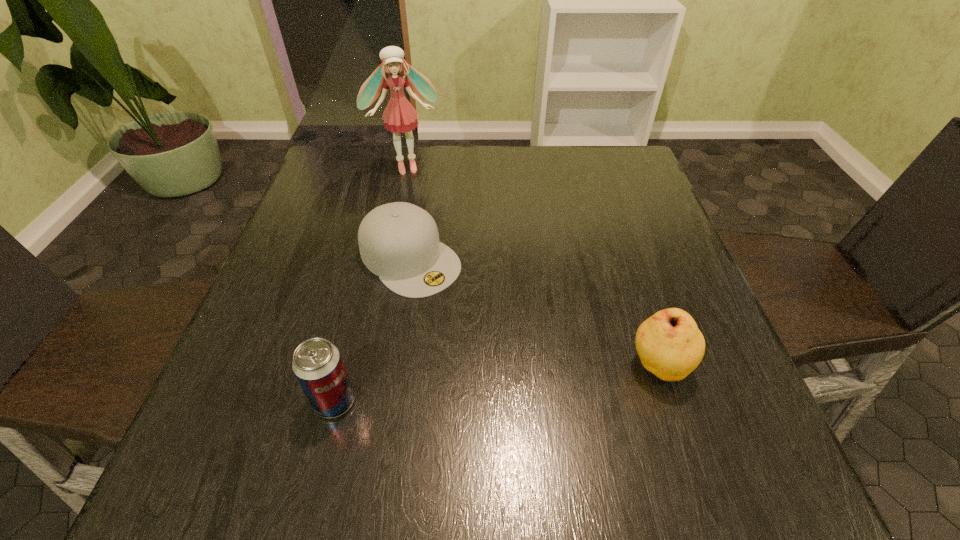
What are the coordinates of `vacant space that satisfies the following two spatial constraints: 1. on the back side of the shortest object; 2. on the left side of the beer can` in the screenshot? It's located at (371, 259).

Where is `free point that satisfies the following two spatial constraints: 1. on the front side of the shortest object; 2. on the right side of the pear`? The height and width of the screenshot is (540, 960). free point that satisfies the following two spatial constraints: 1. on the front side of the shortest object; 2. on the right side of the pear is located at coordinates (393, 366).